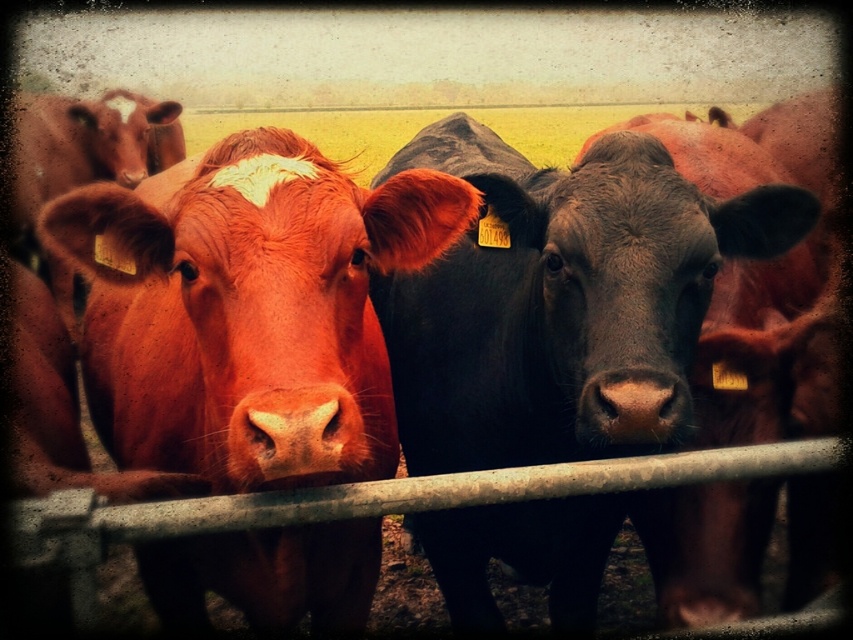
You are a farmer standing at the fence where the cows are. You notice two points marked on the ground near the cows. The first point is at coordinate point (244, 544) and the second point is at coordinate point (244, 468). If you want to place a new feeding station between these two points, which point should you start digging closer to so that the station is closer to the cow on the right?

Since point (244, 544) is behind point (244, 468), you should start digging closer to point (244, 468) to place the feeding station closer to the cow on the right.

You are a farmer checking the cows in your field. You notice the matte orange cow at center and the brown matte nose at center. Which one is more to the left?

The matte orange cow at center is more to the left because it is positioned on the left side of the brown matte nose at center.